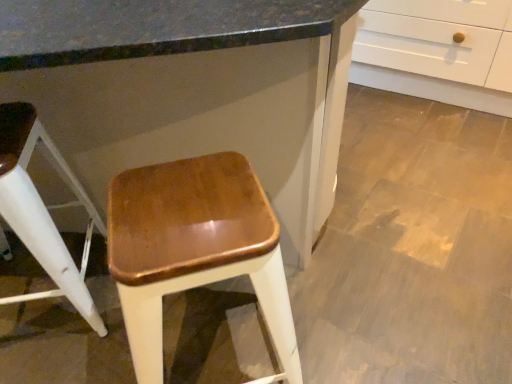
Question: Is white glossy cabinet at upper right in contact with glossy wood stool at center, which ranks as the 1th stool in right-to-left order?

Choices:
 (A) yes
 (B) no

Answer: (B)

Question: From the image's perspective, would you say white glossy cabinet at upper right is positioned over glossy wood stool at center, which ranks as the 1th stool in right-to-left order?

Choices:
 (A) no
 (B) yes

Answer: (B)

Question: Is white glossy cabinet at upper right turned away from glossy wood stool at center, positioned as the 2th stool in left-to-right order?

Choices:
 (A) yes
 (B) no

Answer: (A)

Question: Is white glossy cabinet at upper right smaller than glossy wood stool at center, which ranks as the 1th stool in right-to-left order?

Choices:
 (A) no
 (B) yes

Answer: (A)

Question: Is white glossy cabinet at upper right thinner than glossy wood stool at center, positioned as the 2th stool in left-to-right order?

Choices:
 (A) no
 (B) yes

Answer: (A)

Question: Is shiny brown wood stool at center, placed as the 2th stool when sorted from right to left, bigger or smaller than glossy wood stool at center, which ranks as the 1th stool in right-to-left order?

Choices:
 (A) big
 (B) small

Answer: (A)

Question: From a real-world perspective, is shiny brown wood stool at center, placed as the 2th stool when sorted from right to left, above or below glossy wood stool at center, positioned as the 2th stool in left-to-right order?

Choices:
 (A) above
 (B) below

Answer: (B)

Question: Do you think shiny brown wood stool at center, placed as the 2th stool when sorted from right to left, is within glossy wood stool at center, positioned as the 2th stool in left-to-right order, or outside of it?

Choices:
 (A) outside
 (B) inside

Answer: (A)

Question: In the image, is shiny brown wood stool at center, acting as the 1th stool starting from the left, on the left side or the right side of glossy wood stool at center, which ranks as the 1th stool in right-to-left order?

Choices:
 (A) right
 (B) left

Answer: (B)

Question: In terms of size, does glossy wood stool at center, positioned as the 2th stool in left-to-right order, appear bigger or smaller than white glossy cabinet at upper right?

Choices:
 (A) small
 (B) big

Answer: (A)

Question: Relative to white glossy cabinet at upper right, is glossy wood stool at center, positioned as the 2th stool in left-to-right order, in front or behind?

Choices:
 (A) front
 (B) behind

Answer: (B)

Question: Is point (139, 327) closer or farther from the camera than point (168, 87)?

Choices:
 (A) farther
 (B) closer

Answer: (B)

Question: From a real-world perspective, is glossy wood stool at center, positioned as the 2th stool in left-to-right order, physically located above or below white glossy cabinet at upper right?

Choices:
 (A) above
 (B) below

Answer: (B)

Question: Considering the positions of white glossy cabinet at upper right and shiny brown wood stool at center, placed as the 2th stool when sorted from right to left, in the image, is white glossy cabinet at upper right wider or thinner than shiny brown wood stool at center, placed as the 2th stool when sorted from right to left,?

Choices:
 (A) wide
 (B) thin

Answer: (A)

Question: From a real-world perspective, relative to shiny brown wood stool at center, placed as the 2th stool when sorted from right to left, is white glossy cabinet at upper right vertically above or below?

Choices:
 (A) below
 (B) above

Answer: (B)